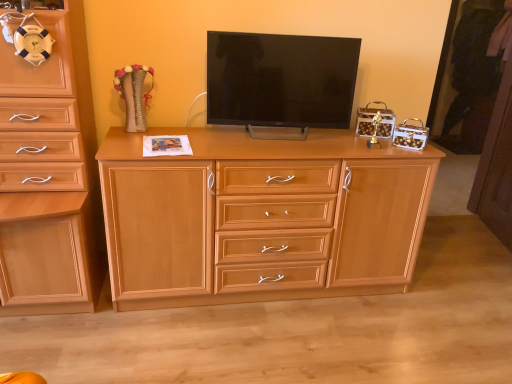
Question: From the image's perspective, is light wood cabinet at left, the 1th chest of drawers from the left, located above or below matte black tv at center?

Choices:
 (A) below
 (B) above

Answer: (A)

Question: Is point (49, 79) closer or farther from the camera than point (286, 64)?

Choices:
 (A) closer
 (B) farther

Answer: (A)

Question: Which is farther from the light wood chest of drawers at center, marked as the first chest of drawers in a right-to-left arrangement?

Choices:
 (A) light wood cabinet at left, the 1th chest of drawers from the left
 (B) matte black tv at center

Answer: (A)

Question: Based on their relative distances, which object is nearer to the light wood chest of drawers at center, placed as the second chest of drawers when sorted from left to right?

Choices:
 (A) matte black tv at center
 (B) light wood cabinet at left, the 1th chest of drawers from the left

Answer: (A)